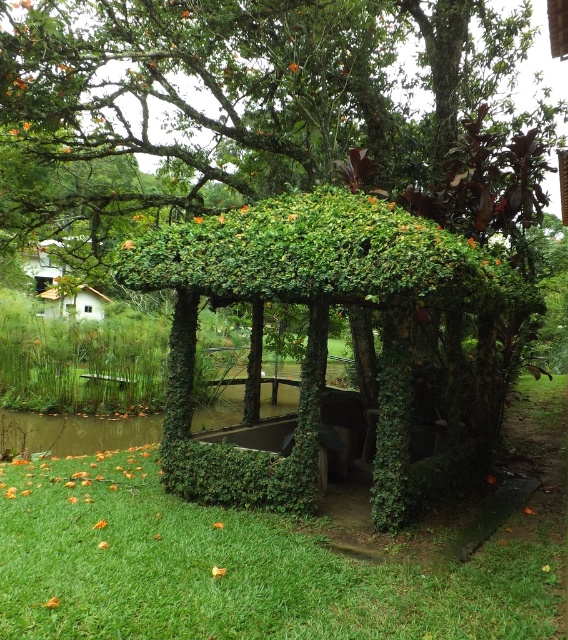
You are standing on the green grass at lower left and want to walk to the green leafy gazebo at center. Which direction should you move to reach it?

You should move upwards to reach the green leafy gazebo at center because the green grass at lower left is below it.

Based on the photo, you are planning to place a large picnic blanket on the green grass at lower left and the green leafy gazebo at center. Which area would allow the blanket to fit more comfortably without overlapping?

The green leafy gazebo at center has a larger size than the green grass at lower left, so placing the picnic blanket there would provide more space and prevent overlapping.